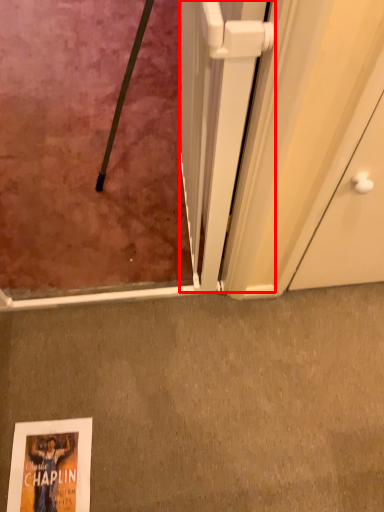
Question: In this image, where is screen door (annotated by the red box) located relative to concrete?

Choices:
 (A) left
 (B) right

Answer: (A)